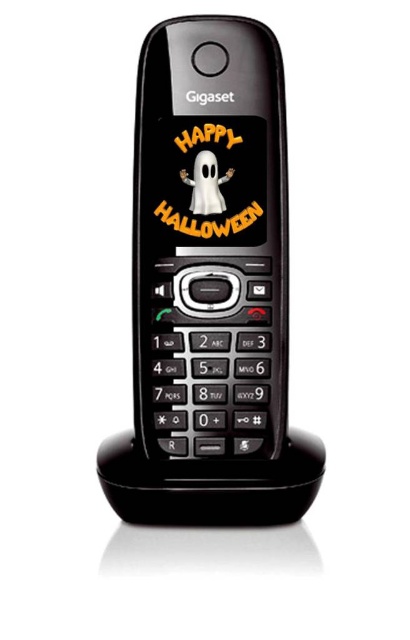
Question: Does black plastic phone at center have a lesser width compared to white matte ghost at center?

Choices:
 (A) yes
 (B) no

Answer: (B)

Question: Can you confirm if black plastic phone at center is wider than white matte ghost at center?

Choices:
 (A) yes
 (B) no

Answer: (A)

Question: Which object is farther from the camera taking this photo?

Choices:
 (A) black plastic phone at center
 (B) white matte ghost at center

Answer: (B)

Question: Which point is closer to the camera?

Choices:
 (A) (202, 186)
 (B) (179, 250)

Answer: (B)

Question: From the image, what is the correct spatial relationship of black plastic phone at center in relation to white matte ghost at center?

Choices:
 (A) right
 (B) left

Answer: (B)